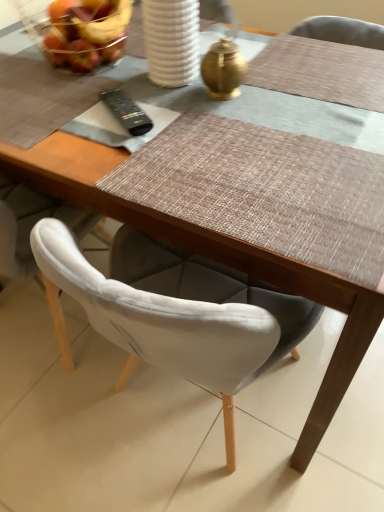
This screenshot has width=384, height=512. Identify the location of black plastic remote at center. (127, 112).

Describe the element at coordinates (127, 112) in the screenshot. I see `black plastic remote at center` at that location.

At what (x,y) coordinates should I click in order to perform the action: click on black plastic remote at center. Please return your answer as a coordinate pair (x, y). The height and width of the screenshot is (512, 384). Looking at the image, I should click on (127, 112).